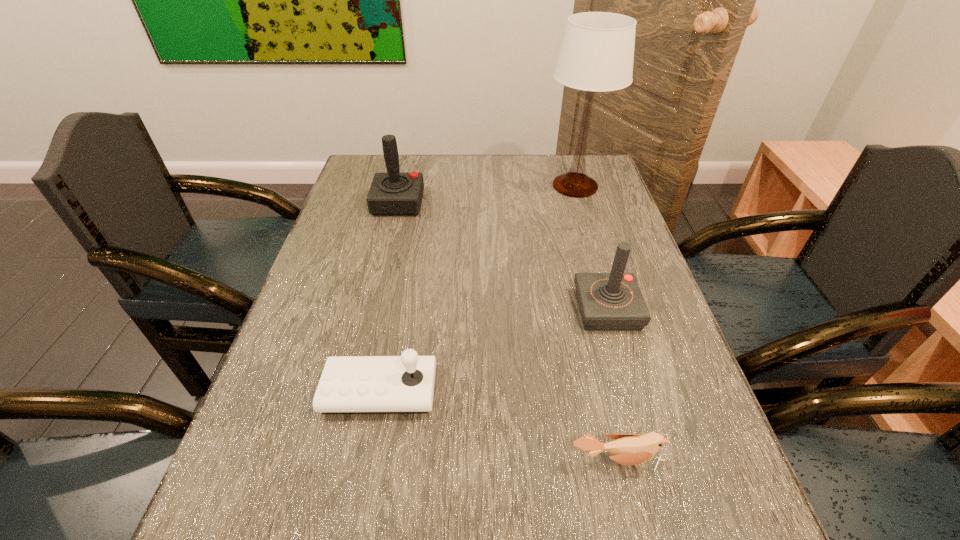
Identify the location of free space between the fourth farthest object and the farthest joystick. This screenshot has height=540, width=960. (389, 297).

Identify the location of unoccupied area between the second nearest joystick and the farthest joystick. (502, 256).

Where is `vacant space in between the farthest joystick and the third nearest object`? vacant space in between the farthest joystick and the third nearest object is located at coordinates (502, 256).

At what (x,y) coordinates should I click in order to perform the action: click on unoccupied position between the second nearest joystick and the tallest object. Please return your answer as a coordinate pair (x, y). Looking at the image, I should click on (591, 248).

At what (x,y) coordinates should I click in order to perform the action: click on free area in between the table lamp and the farthest joystick. Please return your answer as a coordinate pair (x, y). The image size is (960, 540). Looking at the image, I should click on (x=487, y=194).

Where is `free spot between the shortest object and the rightmost joystick`? free spot between the shortest object and the rightmost joystick is located at coordinates (612, 386).

Where is `empty location between the rightmost joystick and the tallest object`? This screenshot has width=960, height=540. empty location between the rightmost joystick and the tallest object is located at coordinates (591, 248).

Where is `free space that is in between the shortest object and the second shortest object`? This screenshot has width=960, height=540. free space that is in between the shortest object and the second shortest object is located at coordinates (498, 426).

Identify the location of object that is the fourth closest to the bird. This screenshot has height=540, width=960. (393, 193).

Identify which object is the closest to the bird. Please provide its 2D coordinates. Your answer should be formatted as a tuple, i.e. [(x, y)], where the tuple contains the x and y coordinates of a point satisfying the conditions above.

[(404, 384)]